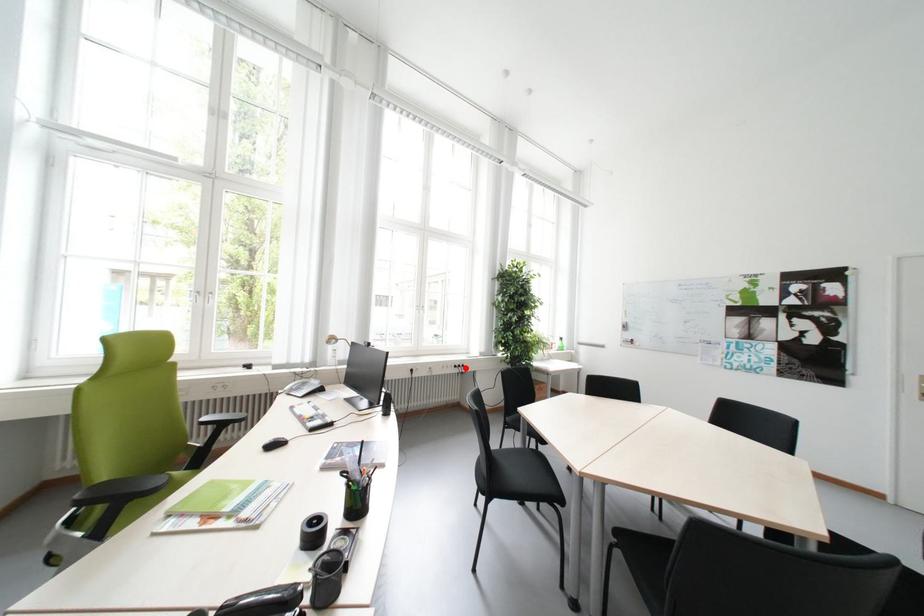
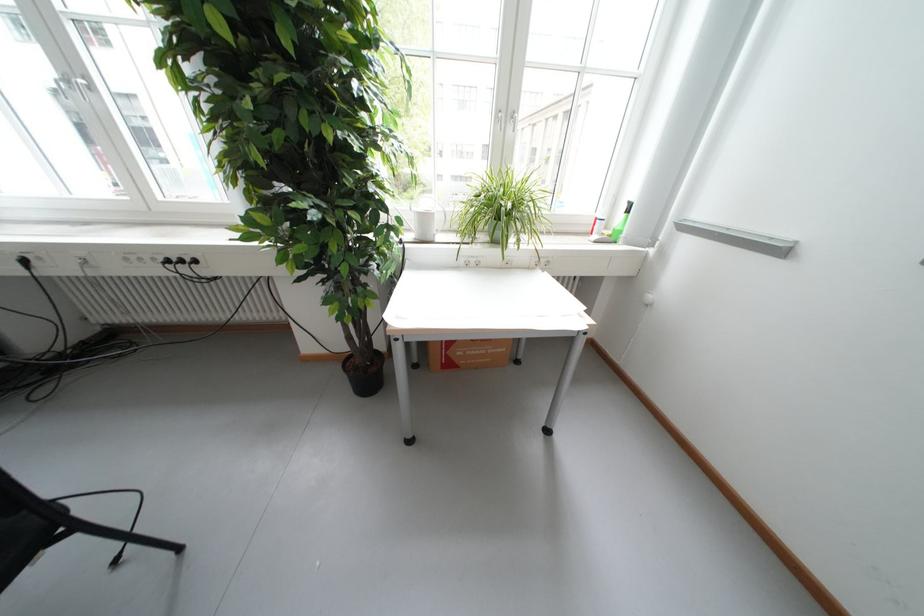
Where in the second image is the point corresponding to the highlighted location from the first image?

(177, 262)